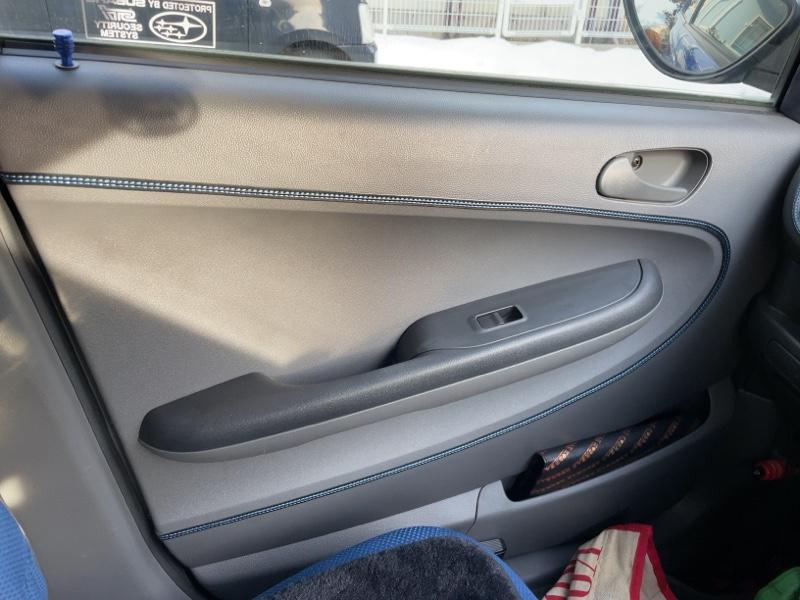
Locate an element on the screen. window is located at coordinates (478, 40).